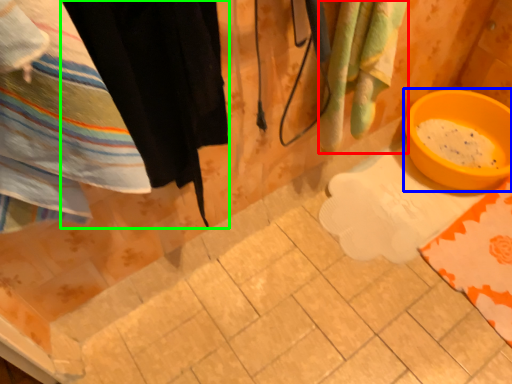
Question: Which object is the farthest from beach towel (highlighted by a red box)? Choose among these: basin (highlighted by a blue box) or clothing (highlighted by a green box).

Choices:
 (A) basin
 (B) clothing

Answer: (A)